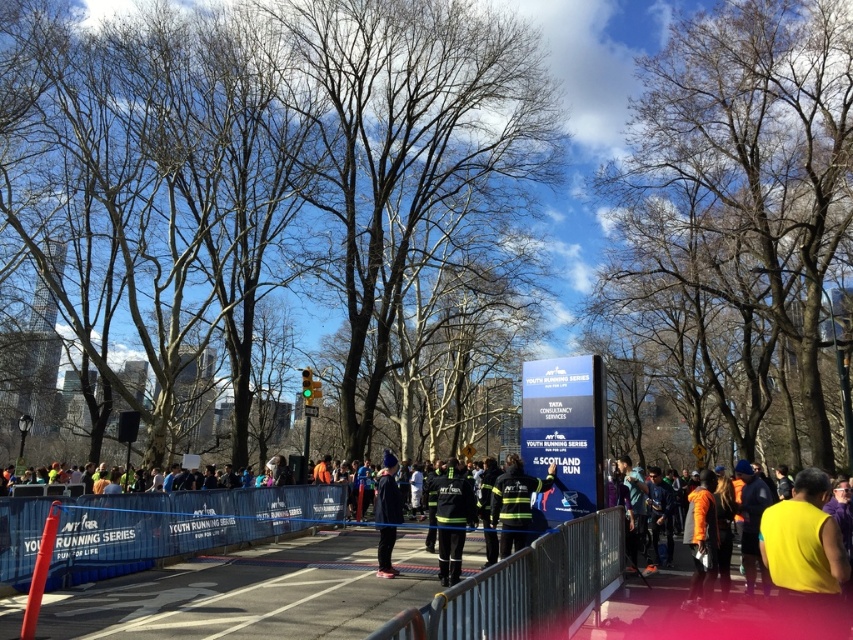
Question: In this image, where is bare wood tree at center located relative to orange fabric jacket at center?

Choices:
 (A) below
 (B) above

Answer: (B)

Question: Considering the real-world distances, which object is closest to the blue fabric barrier at center?

Choices:
 (A) metallic silver barricade at center
 (B) orange fabric jacket at center
 (C) yellow fabric at center
 (D) reflective yellow jacket at center

Answer: (D)

Question: Does orange fabric jacket at center appear on the right side of matte black uniform at center?

Choices:
 (A) yes
 (B) no

Answer: (A)

Question: Can you confirm if blue fabric barrier at center is smaller than reflective yellow jacket at center?

Choices:
 (A) yes
 (B) no

Answer: (A)

Question: Among these objects, which one is nearest to the camera?

Choices:
 (A) metallic silver barricade at center
 (B) reflective yellow jacket at center
 (C) yellow fabric at center

Answer: (C)

Question: Which point appears closest to the camera in this image?

Choices:
 (A) (809, 246)
 (B) (80, 502)

Answer: (B)